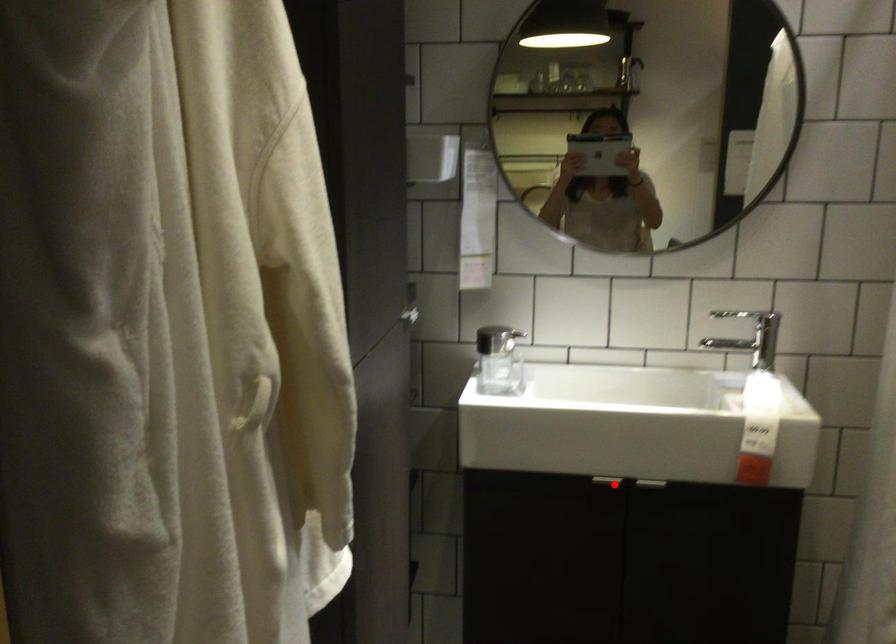
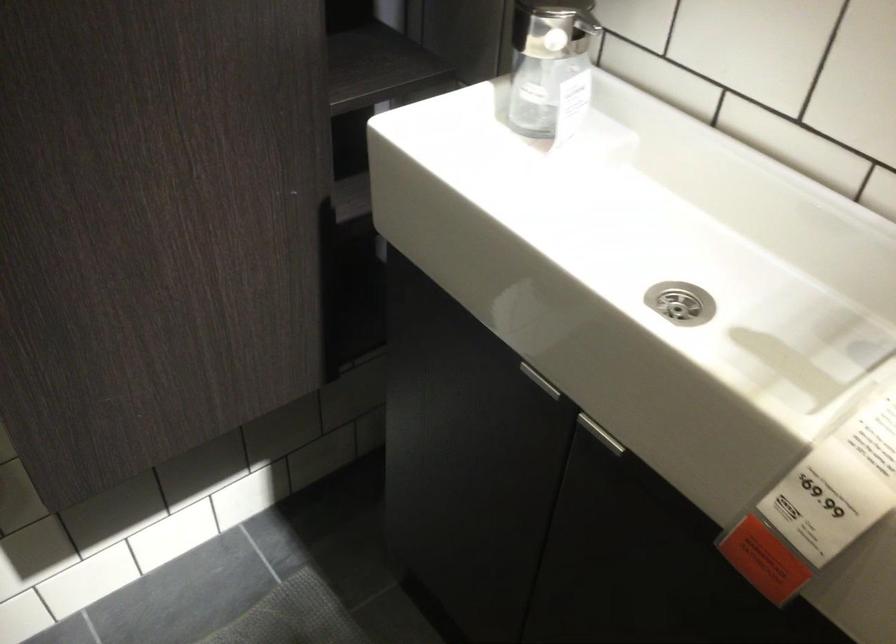
Locate, in the second image, the point that corresponds to the highlighted location in the first image.

(538, 381)